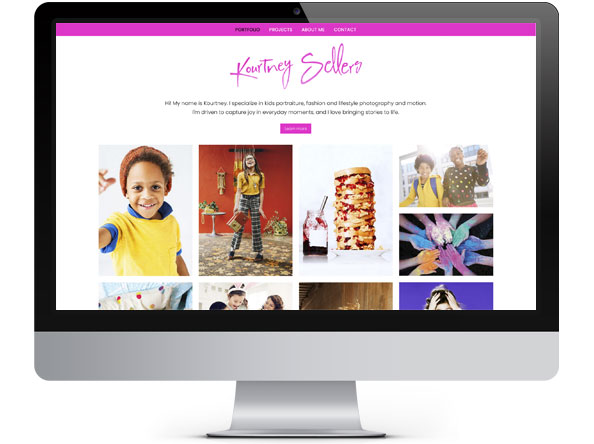
Identify the location of computer monitor. The image size is (594, 444). point(473,362).